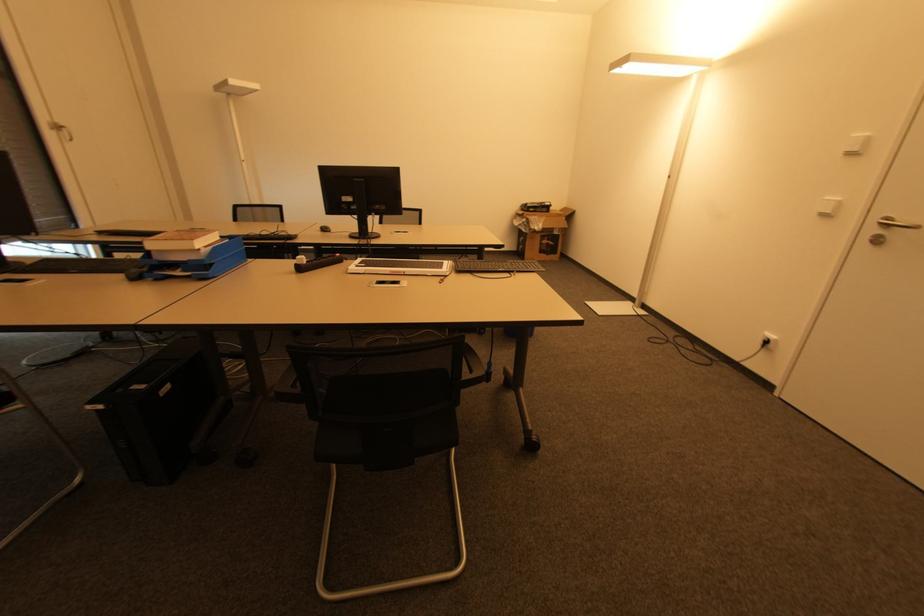
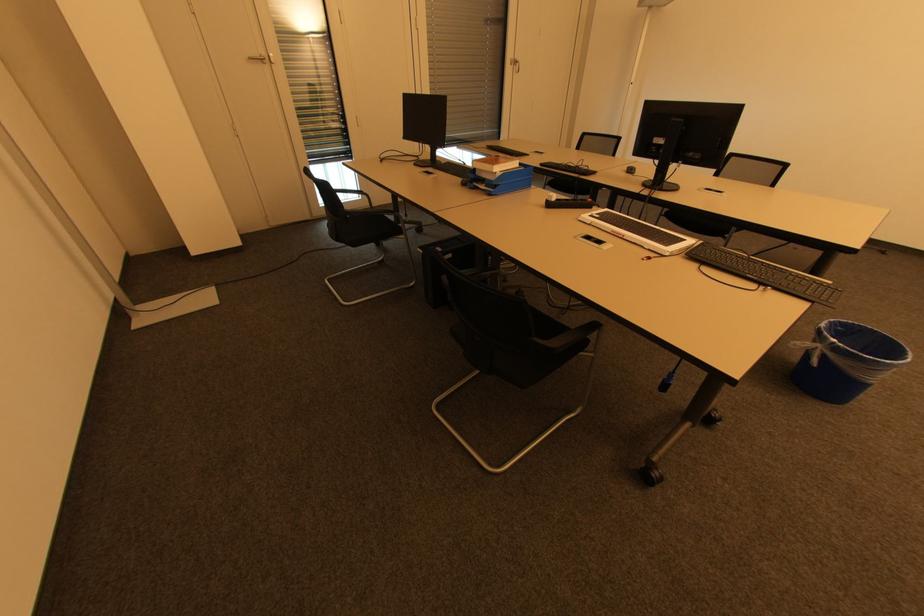
Find the pixel in the second image that matches the point at 178,274 in the first image.

(484, 187)